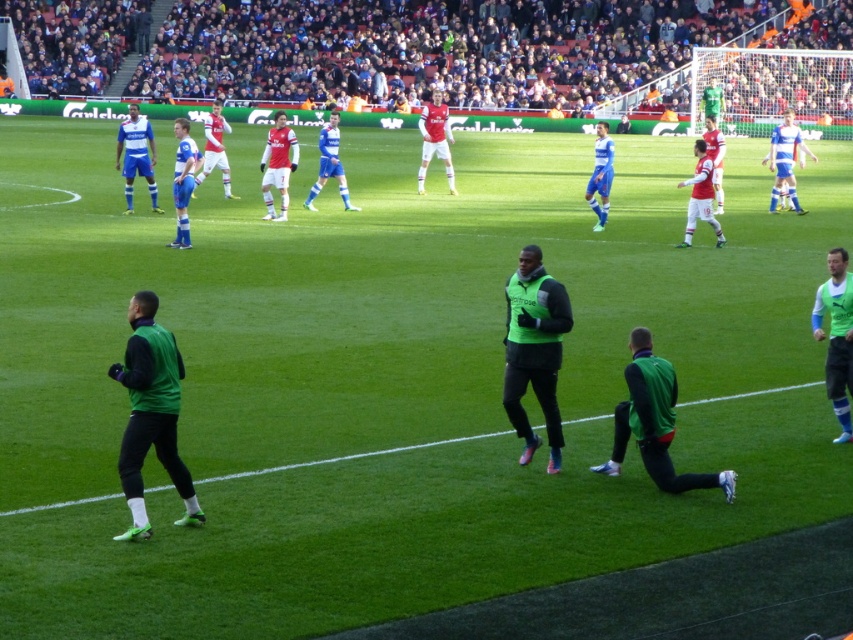
You are a photographer positioned at the edge of the soccer field. You need to capture a wide shot that includes both the green matte jacket at center and the white jersey at center. Given that your camera has a fixed focal length, which object should you frame closer to the edge of the frame to ensure both are visible?

Since the green matte jacket at center is narrower than the white jersey at center, you should position the green matte jacket at center closer to the edge of the frame to accommodate the wider white jersey at center within the shot.